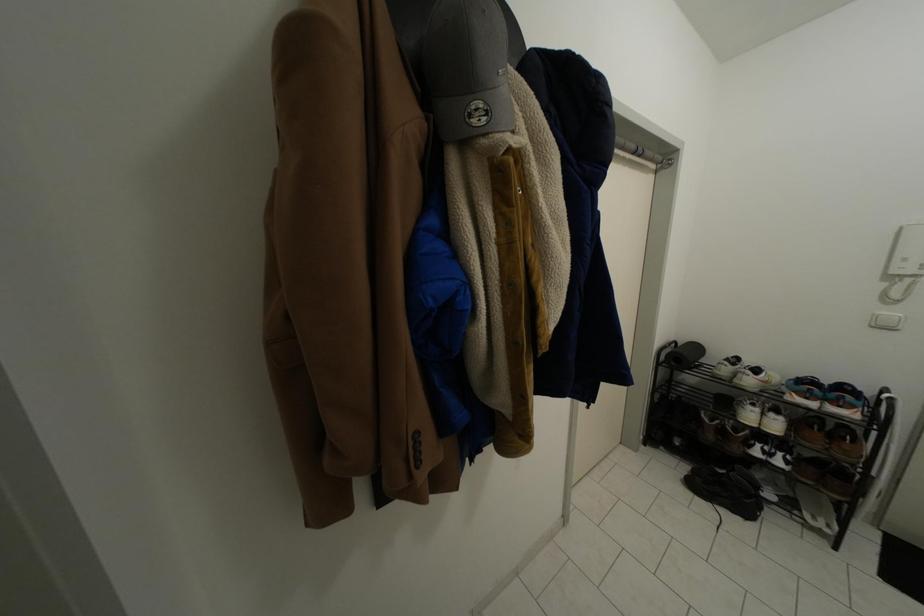
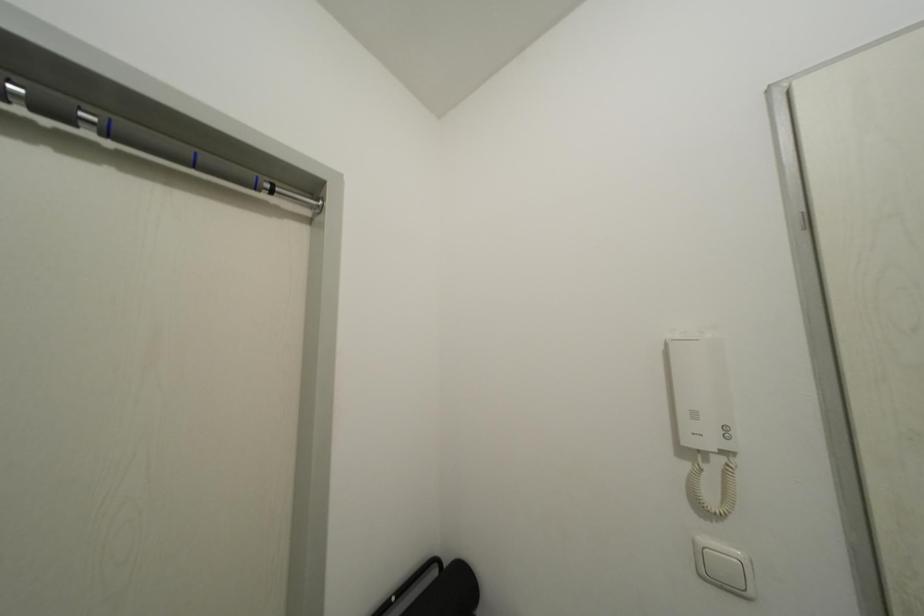
What movement of the cameraman would produce the second image?

The movement direction of the cameraman is right, forward.